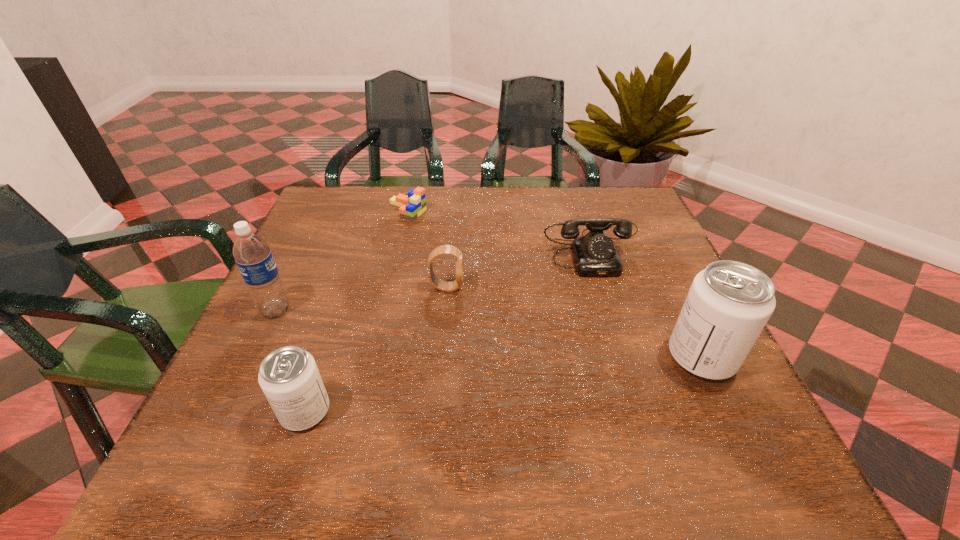
The image size is (960, 540). I want to click on water bottle, so click(251, 252).

Where is `free space located on the right of the third tallest object`? Image resolution: width=960 pixels, height=540 pixels. free space located on the right of the third tallest object is located at coordinates (546, 411).

The image size is (960, 540). In order to click on free space located on the back of the farther soda can in this screenshot , I will do `click(638, 226)`.

Identify the location of free region located 0.330m on the front of the third object from left to right. This screenshot has width=960, height=540. (385, 308).

Locate an element on the screen. free space located on the front-facing side of the telephone is located at coordinates (639, 388).

Where is `vacant region located on the face of the watch`? The height and width of the screenshot is (540, 960). vacant region located on the face of the watch is located at coordinates (592, 288).

Identify the location of vacant point located on the front of the leftmost object. (229, 406).

What are the coordinates of `Lego that is at the far edge` in the screenshot? It's located at (412, 206).

In order to click on telephone that is at the far edge in this screenshot , I will do `click(595, 255)`.

The height and width of the screenshot is (540, 960). In order to click on soda can present at the left edge in this screenshot , I will do `click(289, 377)`.